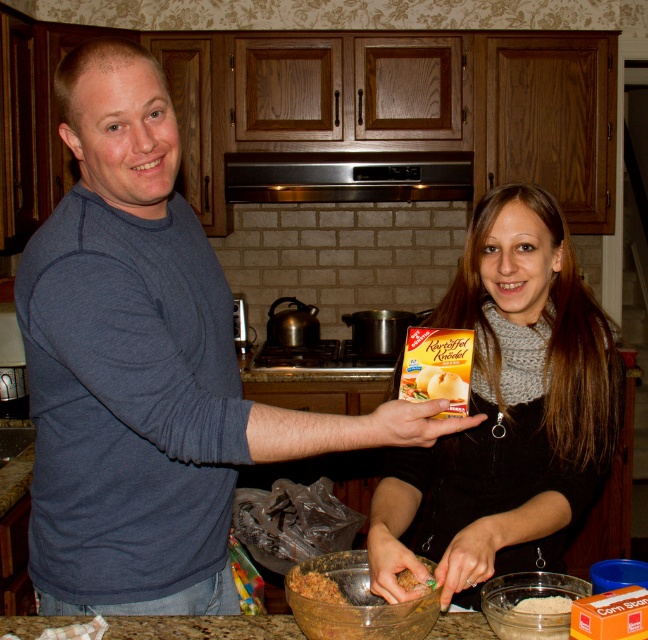
What do you see at coordinates (146, 368) in the screenshot? I see `matte blue sweater at center` at bounding box center [146, 368].

Describe the element at coordinates (146, 368) in the screenshot. Image resolution: width=648 pixels, height=640 pixels. I see `matte blue sweater at center` at that location.

At what (x,y) coordinates should I click in order to perform the action: click on matte blue sweater at center. Please return your answer as a coordinate pair (x, y). Looking at the image, I should click on (146, 368).

Between black knit scarf at center and shiny brown mixture at center, which one appears on the left side from the viewer's perspective?

Positioned to the left is shiny brown mixture at center.

Is black knit scarf at center in front of shiny brown mixture at center?

Yes, black knit scarf at center is in front of shiny brown mixture at center.

Which is behind, point (522, 205) or point (292, 579)?

The point (522, 205) is behind.

I want to click on black knit scarf at center, so click(507, 410).

Does point (132, 547) come behind point (426, 540)?

No, it is not.

Does matte blue sweater at center come behind black knit scarf at center?

No, it is not.

You are a GUI agent. You are given a task and a screenshot of the screen. Output one action in this format:
    pyautogui.click(x=<x>, y=<y>)
    Task: Click on the matte blue sweater at center
    This screenshot has height=640, width=648.
    Given the screenshot: What is the action you would take?
    pyautogui.click(x=146, y=368)

This screenshot has width=648, height=640. Identify the location of matte blue sweater at center. (146, 368).